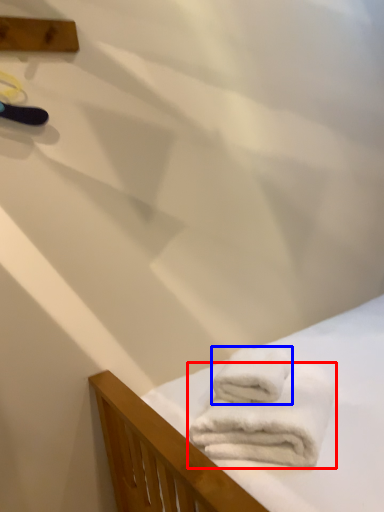
Question: Which of the following is the closest to the observer, towel (highlighted by a red box) or towel (highlighted by a blue box)?

Choices:
 (A) towel
 (B) towel

Answer: (A)